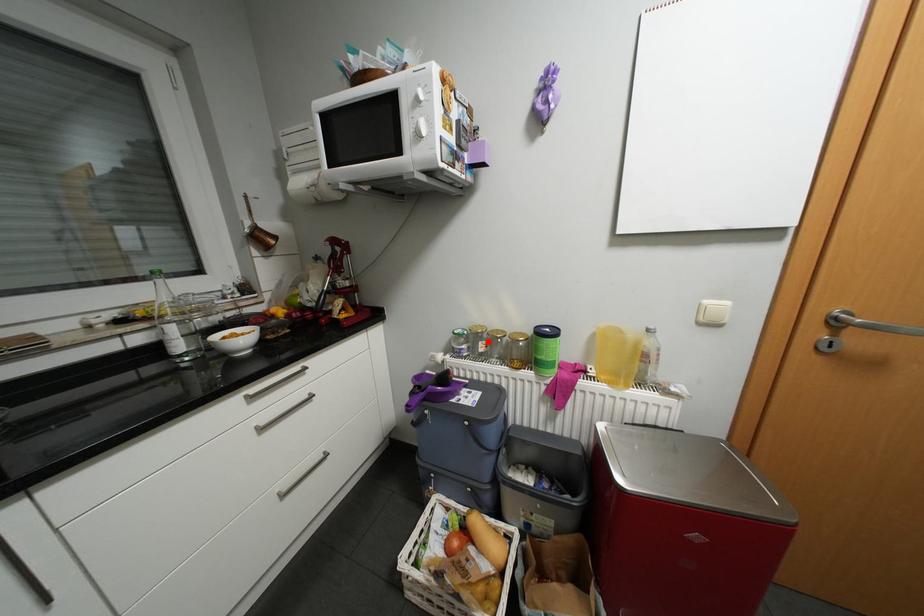
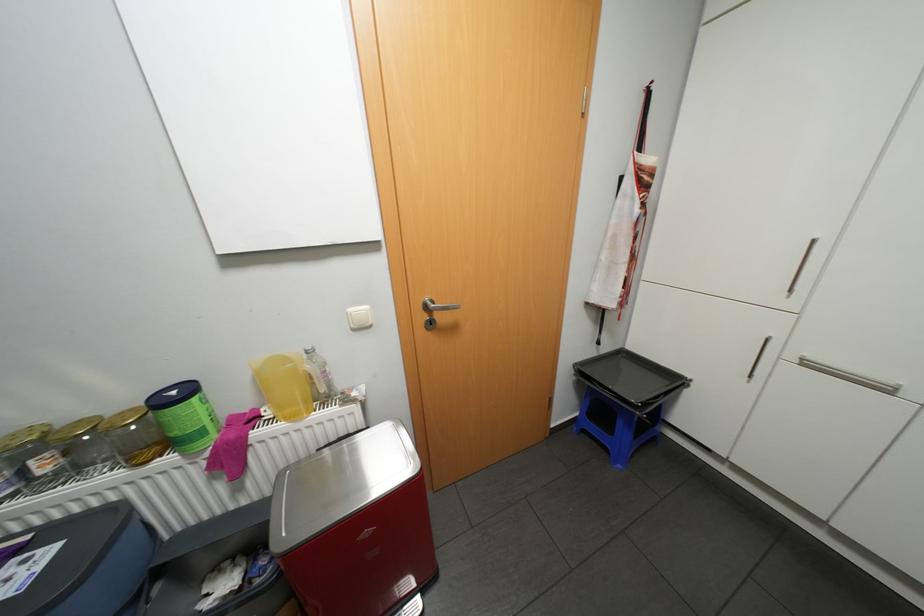
Question: A red point is marked in image1. In image2, is the corresponding 3D point closer to the camera or farther? Reply with the corresponding letter.

Choices:
 (A) The corresponding 3D point is closer.
 (B) The corresponding 3D point is farther.

Answer: (A)